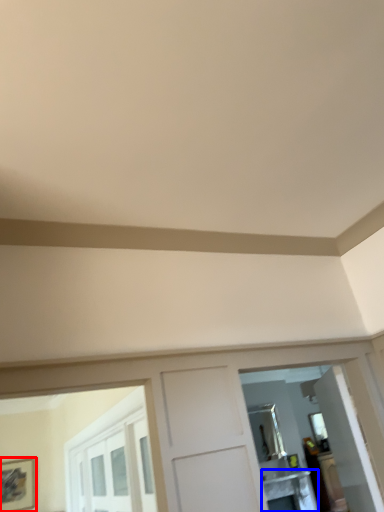
Question: Among these objects, which one is nearest to the camera, picture frame (highlighted by a red box) or table (highlighted by a blue box)?

Choices:
 (A) picture frame
 (B) table

Answer: (A)